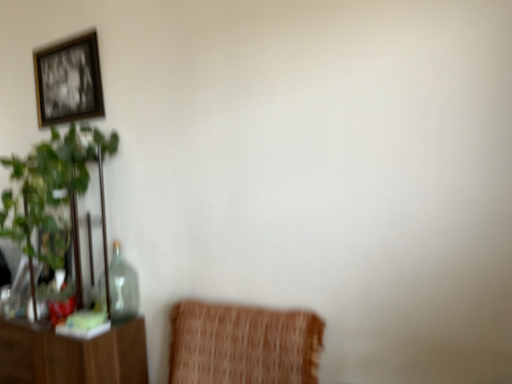
The image size is (512, 384). I want to click on gold-framed picture at upper left, so click(68, 81).

Find the location of `green leafy plant at left`. green leafy plant at left is located at coordinates (50, 186).

Can you confirm if gold-framed picture at upper left is smaller than transparent glass bottle at left?

Indeed, gold-framed picture at upper left has a smaller size compared to transparent glass bottle at left.

This screenshot has height=384, width=512. Find the location of `glass vase lying in front of the gold-framed picture at upper left`. glass vase lying in front of the gold-framed picture at upper left is located at coordinates (122, 287).

Which is closer to the camera, [88,87] or [115,258]?

Point [88,87] is positioned farther from the camera compared to point [115,258].

Which of these two, green leafy plant at left or gold-framed picture at upper left, stands taller?

green leafy plant at left is taller.

Is green leafy plant at left to the right of gold-framed picture at upper left from the viewer's perspective?

Indeed, green leafy plant at left is positioned on the right side of gold-framed picture at upper left.

In the scene shown: Does green leafy plant at left turn towards gold-framed picture at upper left?

No, green leafy plant at left is not facing towards gold-framed picture at upper left.

Find the location of a particular element. picture frame that appears above the transparent glass bottle at left (from a real-world perspective) is located at coordinates (68, 81).

In terms of height, does transparent glass bottle at left look taller or shorter compared to gold-framed picture at upper left?

Considering their sizes, transparent glass bottle at left has less height than gold-framed picture at upper left.

From the picture: Is transparent glass bottle at left at the right side of gold-framed picture at upper left?

Indeed, transparent glass bottle at left is positioned on the right side of gold-framed picture at upper left.

Locate an element on the screen. glass vase behind the green leafy plant at left is located at coordinates (122, 287).

Are green leafy plant at left and transparent glass bottle at left beside each other?

No, green leafy plant at left is not making contact with transparent glass bottle at left.

Considering the sizes of green leafy plant at left and transparent glass bottle at left in the image, is green leafy plant at left taller or shorter than transparent glass bottle at left?

green leafy plant at left is taller than transparent glass bottle at left.

What's the angular difference between green leafy plant at left and transparent glass bottle at left's facing directions?

The angle between the facing direction of green leafy plant at left and the facing direction of transparent glass bottle at left is 1.51 degrees.

From the image's perspective, is gold-framed picture at upper left above or below green leafy plant at left?

From the image's perspective, gold-framed picture at upper left appears above green leafy plant at left.

From a real-world perspective, relative to green leafy plant at left, is gold-framed picture at upper left vertically above or below?

Clearly, from a real-world perspective, gold-framed picture at upper left is above green leafy plant at left.

Can you confirm if gold-framed picture at upper left is bigger than green leafy plant at left?

Actually, gold-framed picture at upper left might be smaller than green leafy plant at left.

Based on the photo, is there a large distance between gold-framed picture at upper left and green leafy plant at left?

No, there isn't a large distance between gold-framed picture at upper left and green leafy plant at left.

From the picture: From the image's perspective, would you say transparent glass bottle at left is shown under green leafy plant at left?

Indeed, from the image's perspective, transparent glass bottle at left is shown beneath green leafy plant at left.

Is transparent glass bottle at left inside or outside of green leafy plant at left?

transparent glass bottle at left exists entirely within green leafy plant at left.

Considering the positions of point (112, 275) and point (90, 136), is point (112, 275) closer or farther from the camera than point (90, 136)?

Point (112, 275).

From a real-world perspective, who is located lower, transparent glass bottle at left or green leafy plant at left?

In real-world perspective, transparent glass bottle at left is lower.

This screenshot has height=384, width=512. Identify the location of picture frame that is behind the transparent glass bottle at left. (68, 81).

You are a GUI agent. You are given a task and a screenshot of the screen. Output one action in this format:
    pyautogui.click(x=<x>, y=<y>)
    Task: Click on the houseplant that is under the gold-framed picture at upper left (from a real-world perspective)
    
    Given the screenshot: What is the action you would take?
    pyautogui.click(x=50, y=186)

From the image, which object appears to be farther from gold-framed picture at upper left, green leafy plant at left or transparent glass bottle at left?

transparent glass bottle at left lies further to gold-framed picture at upper left than the other object.

Which object lies nearer to the anchor point transparent glass bottle at left, gold-framed picture at upper left or green leafy plant at left?

Among the two, green leafy plant at left is located nearer to transparent glass bottle at left.

Considering their positions, is transparent glass bottle at left positioned further to green leafy plant at left than gold-framed picture at upper left?

gold-framed picture at upper left is further to green leafy plant at left.

Estimate the real-world distances between objects in this image. Which object is closer to green leafy plant at left, gold-framed picture at upper left or transparent glass bottle at left?

transparent glass bottle at left lies closer to green leafy plant at left than the other object.

Based on their spatial positions, is green leafy plant at left or gold-framed picture at upper left further from transparent glass bottle at left?

gold-framed picture at upper left is further to transparent glass bottle at left.

Based on their spatial positions, is transparent glass bottle at left or green leafy plant at left closer to gold-framed picture at upper left?

The object closer to gold-framed picture at upper left is green leafy plant at left.

This screenshot has height=384, width=512. I want to click on houseplant between gold-framed picture at upper left and transparent glass bottle at left from top to bottom, so click(50, 186).